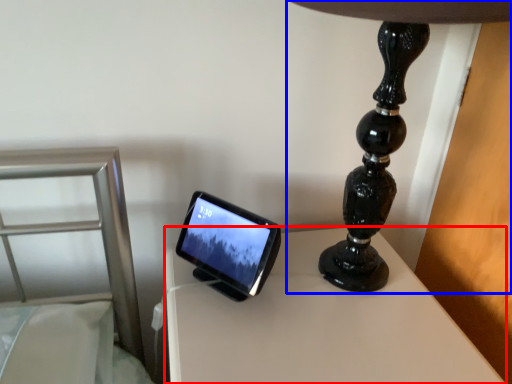
Question: Which point is further to the camera, table (highlighted by a red box) or lamp (highlighted by a blue box)?

Choices:
 (A) table
 (B) lamp

Answer: (A)